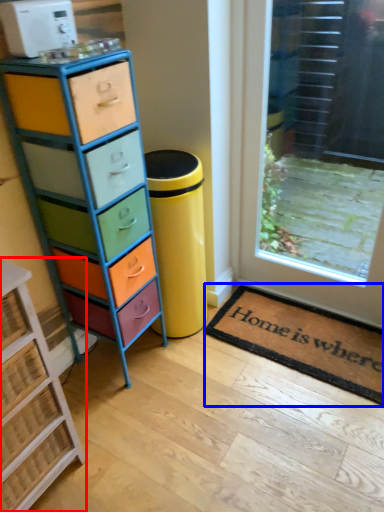
Question: Among these objects, which one is farthest to the camera, chest of drawers (highlighted by a red box) or doormat (highlighted by a blue box)?

Choices:
 (A) chest of drawers
 (B) doormat

Answer: (B)